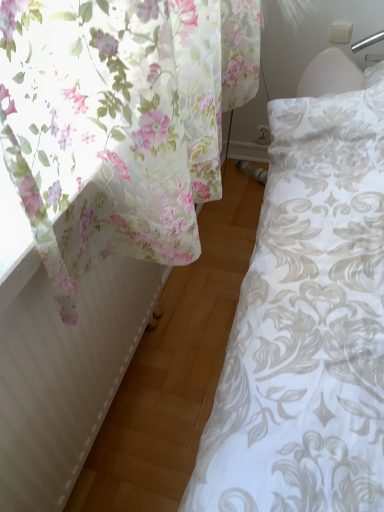
Question: Considering the positions of white textured radiator at left and floral fabric curtain at left in the image, is white textured radiator at left taller or shorter than floral fabric curtain at left?

Choices:
 (A) tall
 (B) short

Answer: (A)

Question: In terms of size, does white textured radiator at left appear bigger or smaller than floral fabric curtain at left?

Choices:
 (A) small
 (B) big

Answer: (A)

Question: Choose the correct answer: Is white textured radiator at left inside floral fabric curtain at left or outside it?

Choices:
 (A) outside
 (B) inside

Answer: (A)

Question: Does point (72, 262) appear closer or farther from the camera than point (54, 435)?

Choices:
 (A) closer
 (B) farther

Answer: (A)

Question: Is floral fabric curtain at left inside or outside of white textured radiator at left?

Choices:
 (A) inside
 (B) outside

Answer: (B)

Question: From a real-world perspective, relative to white textured radiator at left, is floral fabric curtain at left vertically above or below?

Choices:
 (A) below
 (B) above

Answer: (B)

Question: In terms of width, does floral fabric curtain at left look wider or thinner when compared to white textured radiator at left?

Choices:
 (A) thin
 (B) wide

Answer: (B)